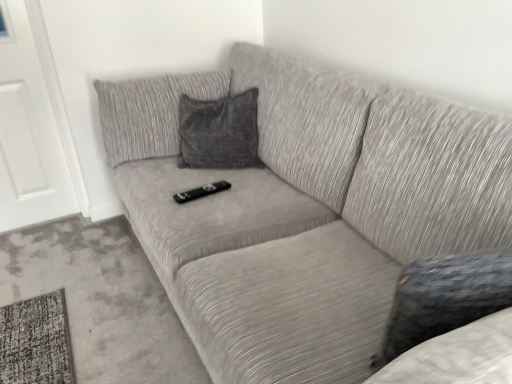
Question: Is white matte door at left positioned in front of black plastic remote at center?

Choices:
 (A) no
 (B) yes

Answer: (A)

Question: Considering the relative positions of white matte door at left and black plastic remote at center in the image provided, is white matte door at left to the left of black plastic remote at center from the viewer's perspective?

Choices:
 (A) no
 (B) yes

Answer: (B)

Question: From the image's perspective, does white matte door at left appear higher than black plastic remote at center?

Choices:
 (A) yes
 (B) no

Answer: (A)

Question: Is white matte door at left oriented away from black plastic remote at center?

Choices:
 (A) yes
 (B) no

Answer: (B)

Question: Is white matte door at left bigger than black plastic remote at center?

Choices:
 (A) no
 (B) yes

Answer: (B)

Question: Based on their sizes in the image, would you say black plastic remote at center is bigger or smaller than white matte door at left?

Choices:
 (A) small
 (B) big

Answer: (A)

Question: Looking at their shapes, would you say black plastic remote at center is wider or thinner than white matte door at left?

Choices:
 (A) thin
 (B) wide

Answer: (B)

Question: From the image's perspective, is black plastic remote at center above or below white matte door at left?

Choices:
 (A) below
 (B) above

Answer: (A)

Question: Is black plastic remote at center situated inside white matte door at left or outside?

Choices:
 (A) outside
 (B) inside

Answer: (A)

Question: Is white matte door at left to the left or to the right of textured gray couch at center in the image?

Choices:
 (A) left
 (B) right

Answer: (A)

Question: In the image, is white matte door at left positioned in front of or behind textured gray couch at center?

Choices:
 (A) behind
 (B) front

Answer: (A)

Question: Considering the positions of white matte door at left and textured gray couch at center in the image, is white matte door at left wider or thinner than textured gray couch at center?

Choices:
 (A) wide
 (B) thin

Answer: (B)

Question: Looking at the image, does white matte door at left seem bigger or smaller compared to textured gray couch at center?

Choices:
 (A) big
 (B) small

Answer: (B)

Question: From a real-world perspective, is textured gray couch at center above or below white matte door at left?

Choices:
 (A) below
 (B) above

Answer: (A)

Question: Is textured gray couch at center inside the boundaries of white matte door at left, or outside?

Choices:
 (A) inside
 (B) outside

Answer: (B)